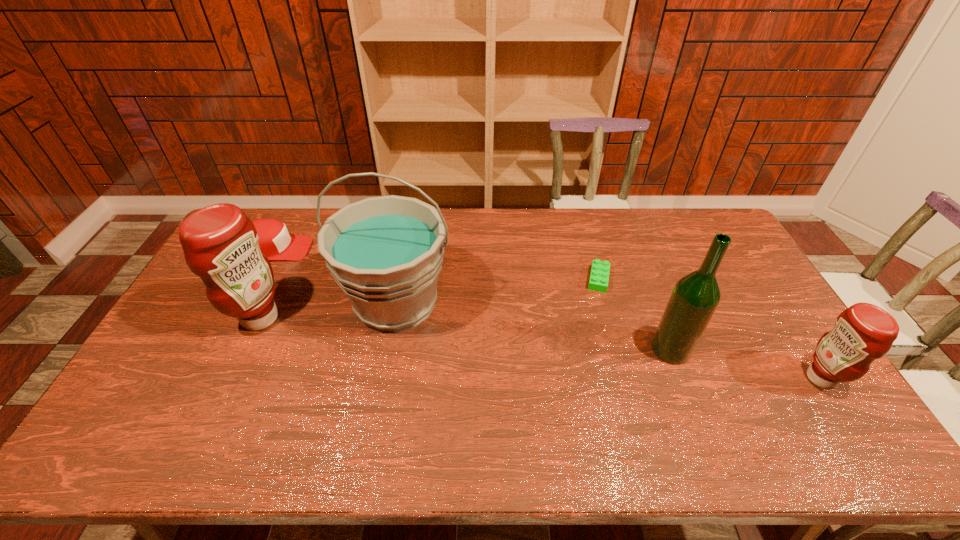
Locate an element on the screen. This screenshot has width=960, height=540. free region located on the front of the taller condiment is located at coordinates (240, 360).

Find the location of a particular element. Image resolution: width=960 pixels, height=540 pixels. vacant region located on the left of the rightmost object is located at coordinates (666, 378).

You are a GUI agent. You are given a task and a screenshot of the screen. Output one action in this format:
    pyautogui.click(x=<x>, y=<y>)
    Task: Click on the free location located on the right of the shortest object
    This screenshot has width=960, height=540.
    Given the screenshot: What is the action you would take?
    pyautogui.click(x=633, y=279)

Find the location of a particular element. The width and height of the screenshot is (960, 540). vacant space located 0.190m on the front of the third object from left to right is located at coordinates (377, 406).

At what (x,y) coordinates should I click in order to perform the action: click on vacant region located 0.200m on the front-facing side of the second shortest object. Please return your answer as a coordinate pair (x, y). Looking at the image, I should click on (367, 249).

Identify the location of free spot located on the back of the fifth object from left to right. The image size is (960, 540). (654, 304).

Locate an element on the screen. This screenshot has width=960, height=540. object present at the far edge is located at coordinates (274, 241).

The height and width of the screenshot is (540, 960). I want to click on object that is at the near edge, so click(x=864, y=332).

Where is `object that is at the left edge`? This screenshot has height=540, width=960. object that is at the left edge is located at coordinates (274, 241).

I want to click on object that is at the right edge, so click(864, 332).